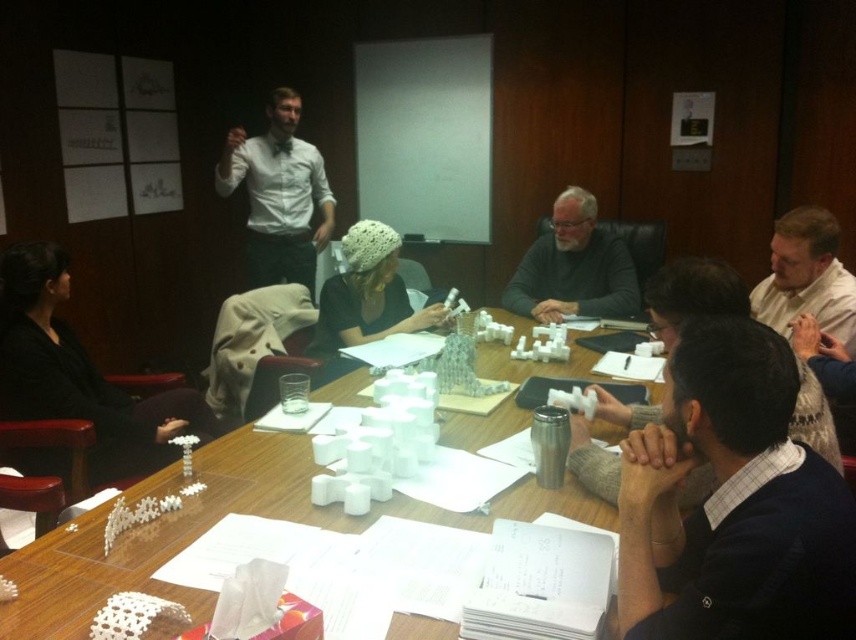
Question: Which point is farther from the camera taking this photo?

Choices:
 (A) (645, 408)
 (B) (266, 134)

Answer: (B)

Question: Does wooden table at center appear over gray matte sweater at center?

Choices:
 (A) no
 (B) yes

Answer: (A)

Question: Is matte white shirt at upper left to the right of gray matte sweater at center from the viewer's perspective?

Choices:
 (A) yes
 (B) no

Answer: (B)

Question: Observing the image, what is the correct spatial positioning of gray matte sweater at center in reference to white knitted hat at center?

Choices:
 (A) above
 (B) below

Answer: (A)

Question: Among these objects, which one is farthest from the camera?

Choices:
 (A) white knitted hat at center
 (B) dark gray sweater at lower right
 (C) gray matte sweater at center
 (D) matte white shirt at upper left

Answer: (D)

Question: Which object is the farthest from the dark gray sweater at lower right?

Choices:
 (A) wooden table at center
 (B) matte white shirt at upper left
 (C) black fabric jacket at lower left
 (D) white knitted hat at center

Answer: (B)